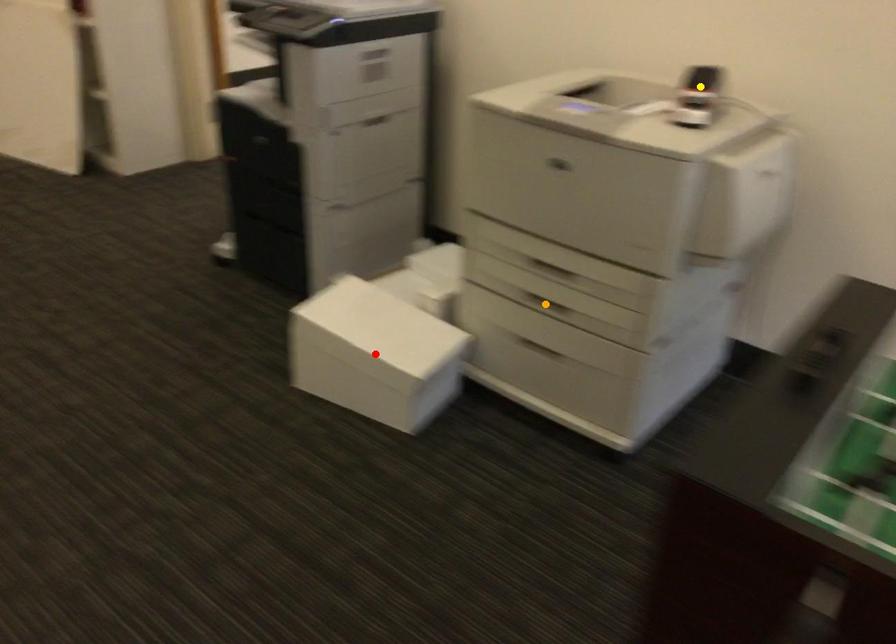
Order these from nearest to farthest:
red point, yellow point, orange point

yellow point → orange point → red point